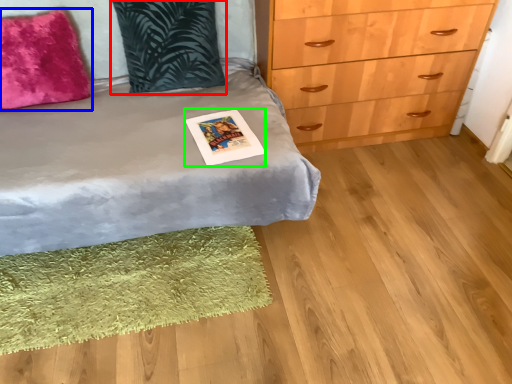
Question: Estimate the real-world distances between objects in this image. Which object is farther from pillow (highlighted by a red box), pillow (highlighted by a blue box) or postcard (highlighted by a green box)?

Choices:
 (A) pillow
 (B) postcard

Answer: (B)